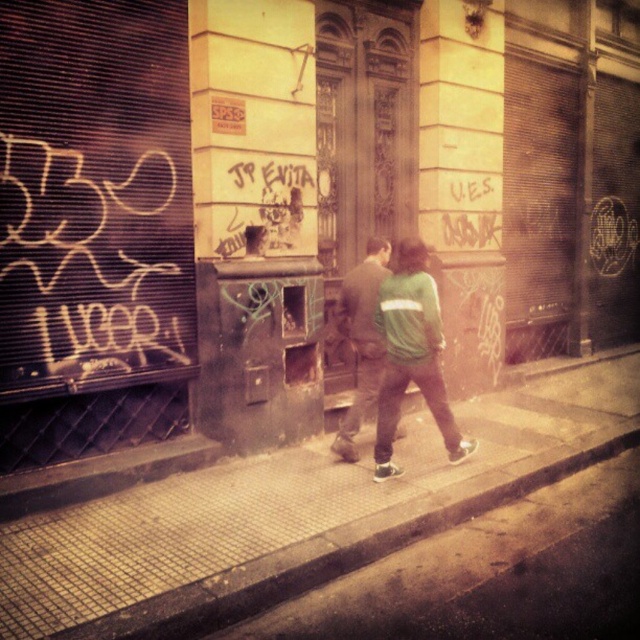
You are a delivery person standing on the smooth concrete sidewalk at center and need to hand a package to the person wearing the green fabric jacket at center. Can you reach them without moving from your current position?

The distance between the smooth concrete sidewalk at center and the green fabric jacket at center is 3.56 feet. Since the sidewalk is a flat surface and you are both on the same level, you can likely reach them by extending your arm as the distance is within typical reaching range.

You are a delivery person trying to deliver a package to the building entrance. You notice the smooth concrete sidewalk at center and the green fabric jacket at center. Which object is taller?

The green fabric jacket at center is taller than the smooth concrete sidewalk at center.